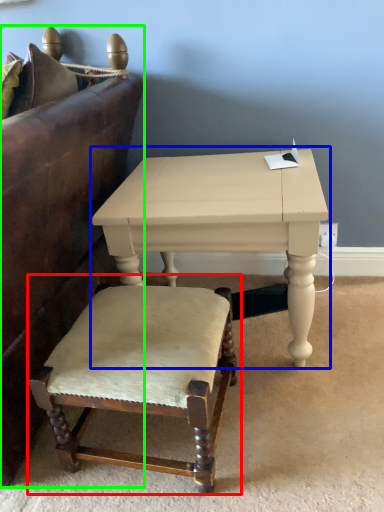
Question: Which object is the farthest from chair (highlighted by a red box)? Choose among these: table (highlighted by a blue box) or studio couch (highlighted by a green box).

Choices:
 (A) table
 (B) studio couch

Answer: (B)